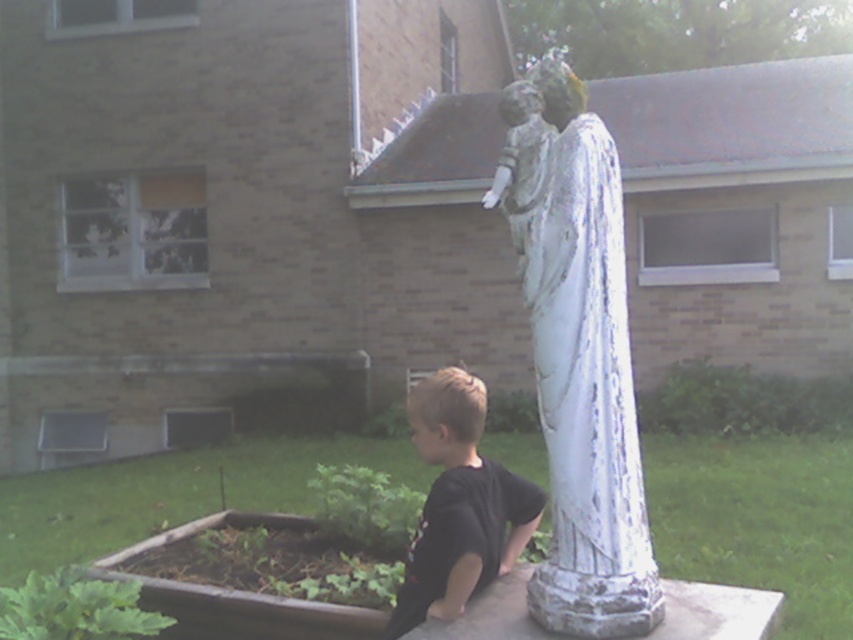
Question: Does black matte shirt at lower center have a lesser width compared to brown wooden flower bed at lower left?

Choices:
 (A) yes
 (B) no

Answer: (A)

Question: Among these objects, which one is nearest to the camera?

Choices:
 (A) white cracked statue at lower right
 (B) brown wooden flower bed at lower left
 (C) white chipped paint statue at center

Answer: (C)

Question: Can you confirm if white cracked statue at lower right is positioned to the right of white chipped paint statue at center?

Choices:
 (A) yes
 (B) no

Answer: (B)

Question: Where is black matte shirt at lower center located in relation to brown wooden flower bed at lower left in the image?

Choices:
 (A) left
 (B) right

Answer: (B)

Question: Which point appears farthest from the camera in this image?

Choices:
 (A) (195, 488)
 (B) (625, 420)

Answer: (A)

Question: Estimate the real-world distances between objects in this image. Which object is farther from the black matte shirt at lower center?

Choices:
 (A) brown wooden flower bed at lower left
 (B) white cracked statue at lower right

Answer: (B)